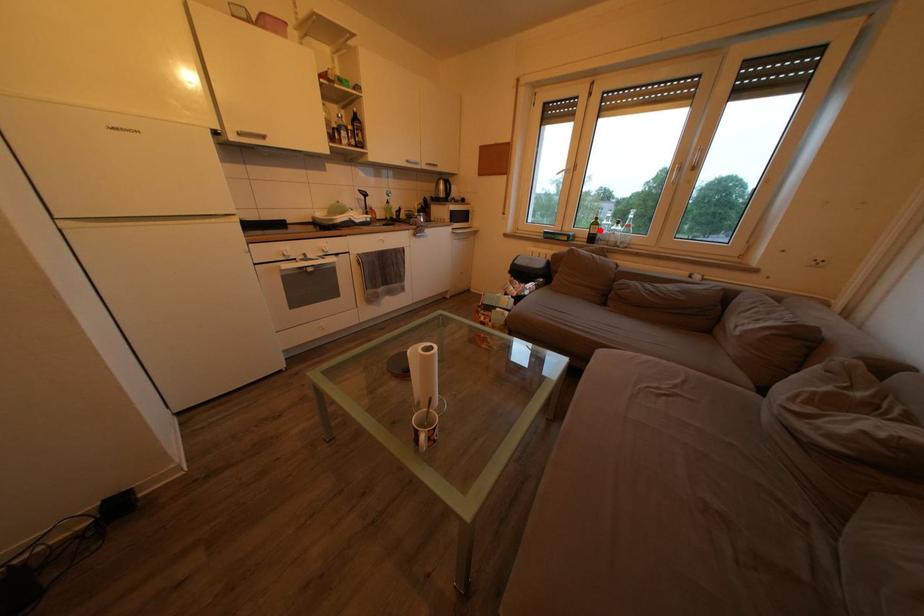
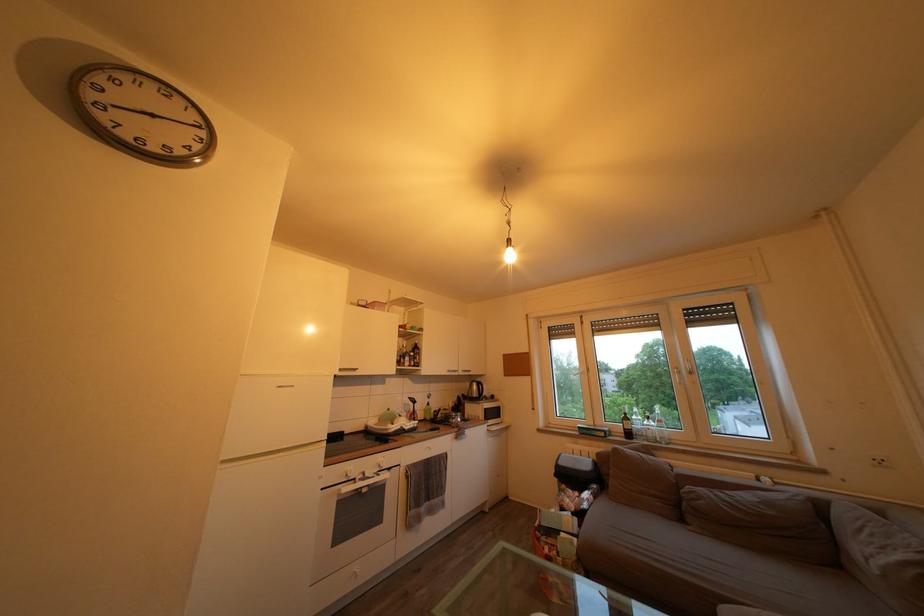
Question: I am providing you with two images of the same scene from different viewpoints. In image1, a red point is highlighted. Considering the same 3D point in image2, which of the following is correct?

Choices:
 (A) It is closer
 (B) It is farther

Answer: (B)